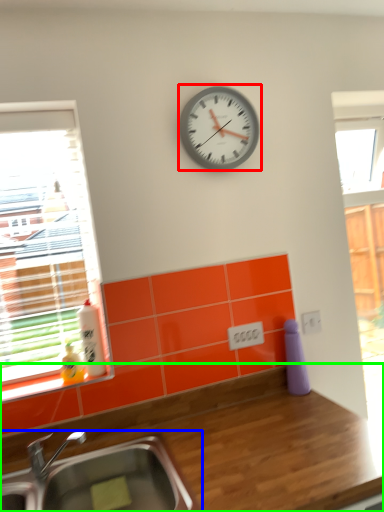
Question: Which object is the closest to the wall clock (highlighted by a red box)? Choose among these: sink (highlighted by a blue box) or countertop (highlighted by a green box).

Choices:
 (A) sink
 (B) countertop

Answer: (B)